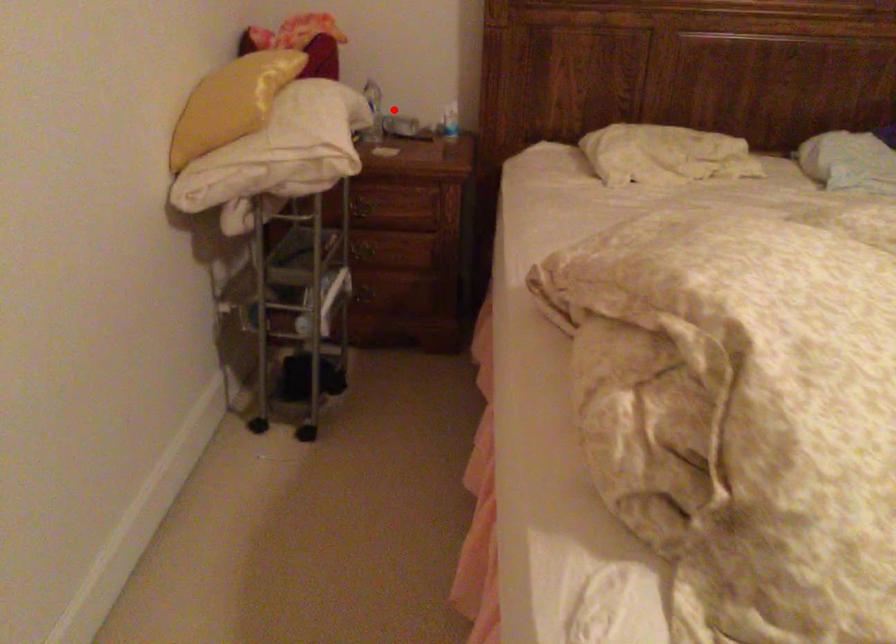
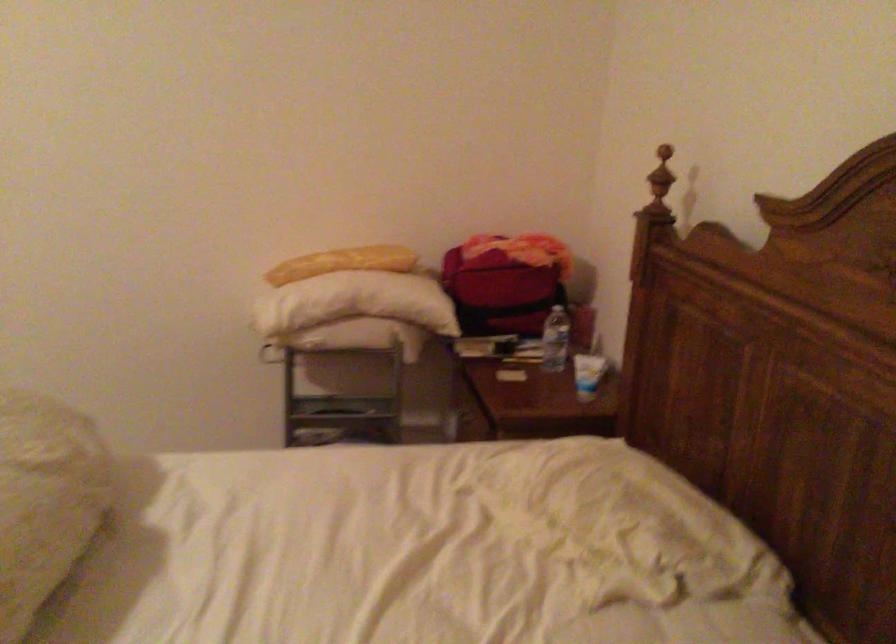
Question: I am providing you with two images of the same scene from different viewpoints. Image1 has a red point marked. In image2, the corresponding 3D location appears at what relative position? Reply with the corresponding letter.

Choices:
 (A) Closer
 (B) Farther

Answer: (A)